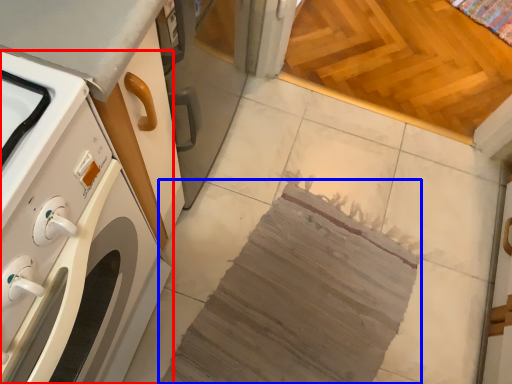
Question: Which point is closer to the camera, home appliance (highlighted by a red box) or blanket (highlighted by a blue box)?

Choices:
 (A) home appliance
 (B) blanket

Answer: (A)